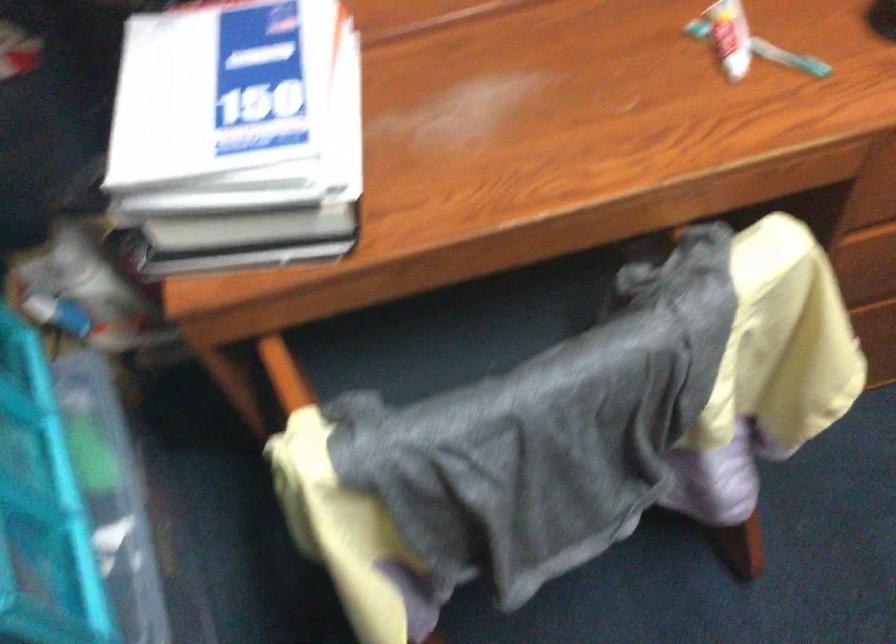
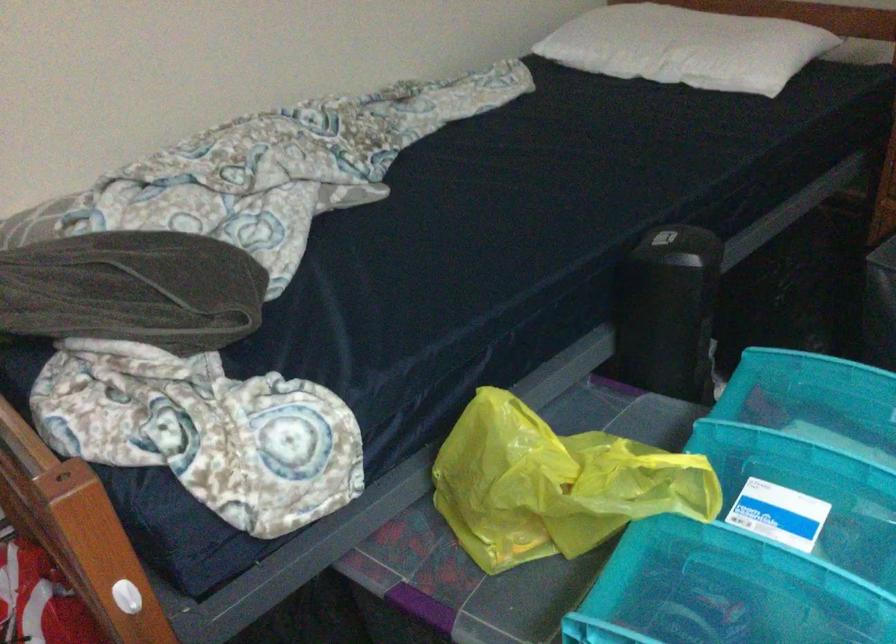
Question: Based on the continuous images, in which direction is the camera rotating? Reply with the corresponding letter.

Choices:
 (A) Left
 (B) Right
 (C) Up
 (D) Down

Answer: (A)